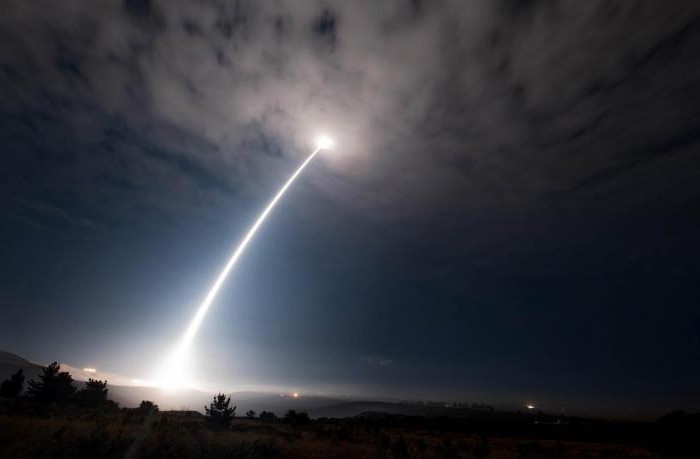
Where is `light`? light is located at coordinates (304, 163).